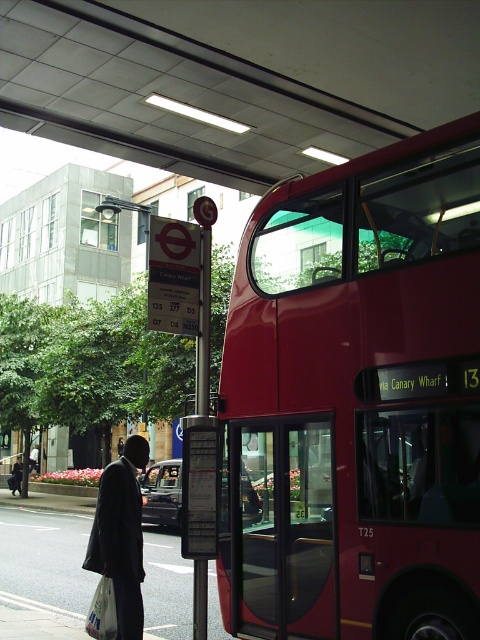
Is dark matte suit at lower left shorter than white plastic bag at lower left?

No.

Which is more to the right, dark matte suit at lower left or white plastic bag at lower left?

From the viewer's perspective, dark matte suit at lower left appears more on the right side.

Between point (141, 461) and point (92, 627), which one is positioned in front?

Point (92, 627)

At what (x,y) coordinates should I click in order to perform the action: click on dark matte suit at lower left. Please return your answer as a coordinate pair (x, y). This screenshot has width=480, height=640. Looking at the image, I should click on (120, 536).

Does shiny red bus at right appear under dark matte suit at lower left?

No.

Is point (408, 260) closer to camera compared to point (107, 516)?

No, it is behind (107, 516).

Image resolution: width=480 pixels, height=640 pixels. What do you see at coordinates (356, 401) in the screenshot? I see `shiny red bus at right` at bounding box center [356, 401].

Where is `shiny red bus at right`? This screenshot has height=640, width=480. shiny red bus at right is located at coordinates (356, 401).

Consider the image. Does shiny red bus at right appear over white plastic bag at lower left?

Correct, shiny red bus at right is located above white plastic bag at lower left.

Locate an element on the screen. The height and width of the screenshot is (640, 480). shiny red bus at right is located at coordinates (356, 401).

Is point (409, 173) positioned in front of point (90, 611)?

No, it is not.

What are the coordinates of `shiny red bus at right` in the screenshot? It's located at (356, 401).